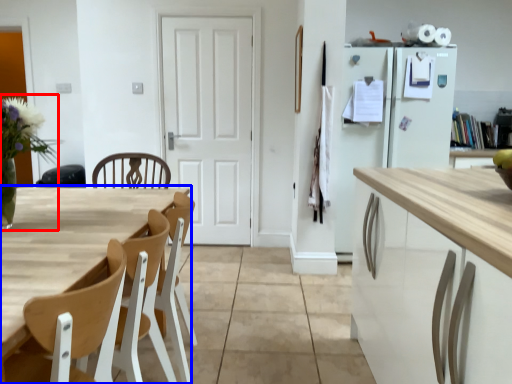
Question: Which of the following is the closest to the observer, floral arrangement (highlighted by a red box) or table (highlighted by a blue box)?

Choices:
 (A) floral arrangement
 (B) table

Answer: (B)